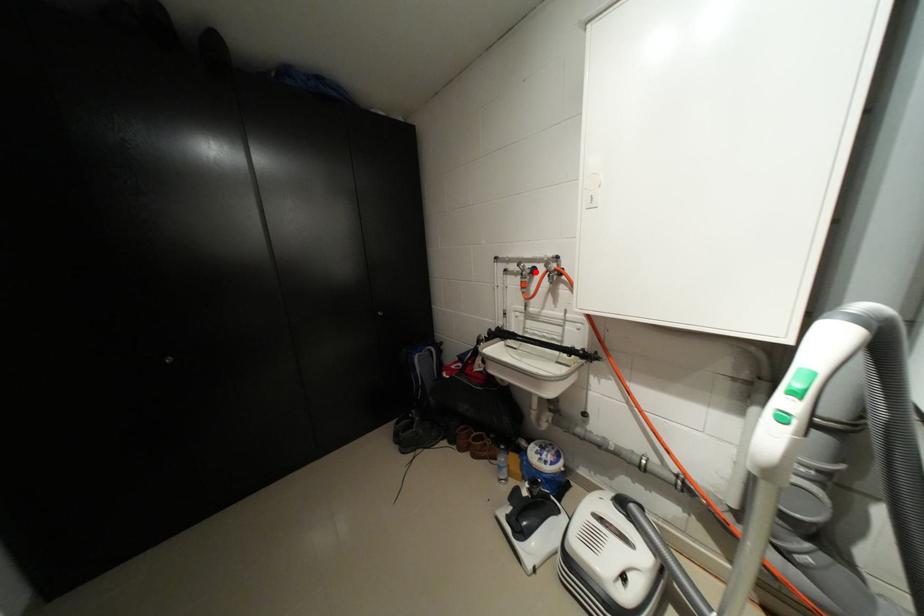
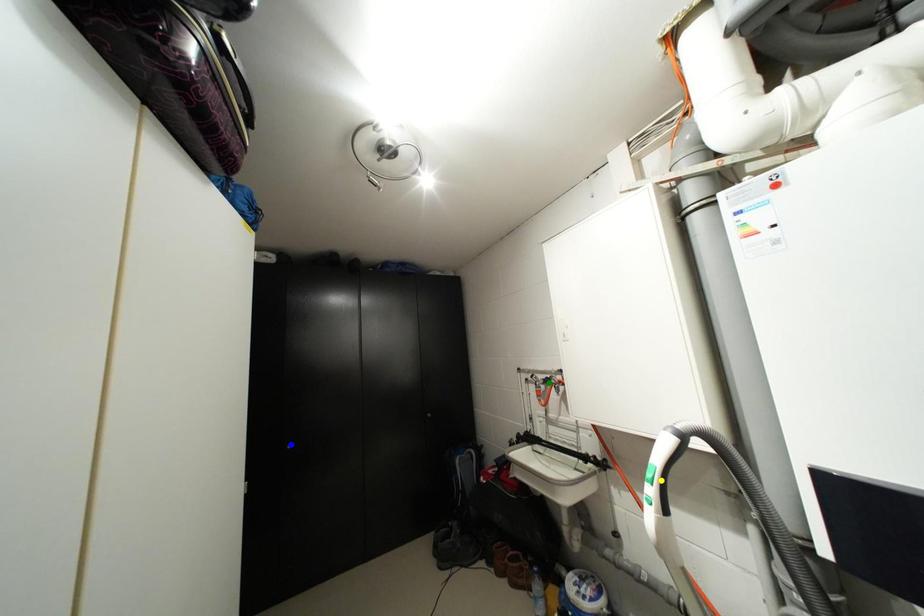
Question: I am providing you with two images of the same scene from different viewpoints. A red point is marked on the first image. You are given multiple points on the second image. In image 2, which mark is for the same physical point as the one in image 1?

Choices:
 (A) green point
 (B) yellow point
 (C) blue point

Answer: (A)